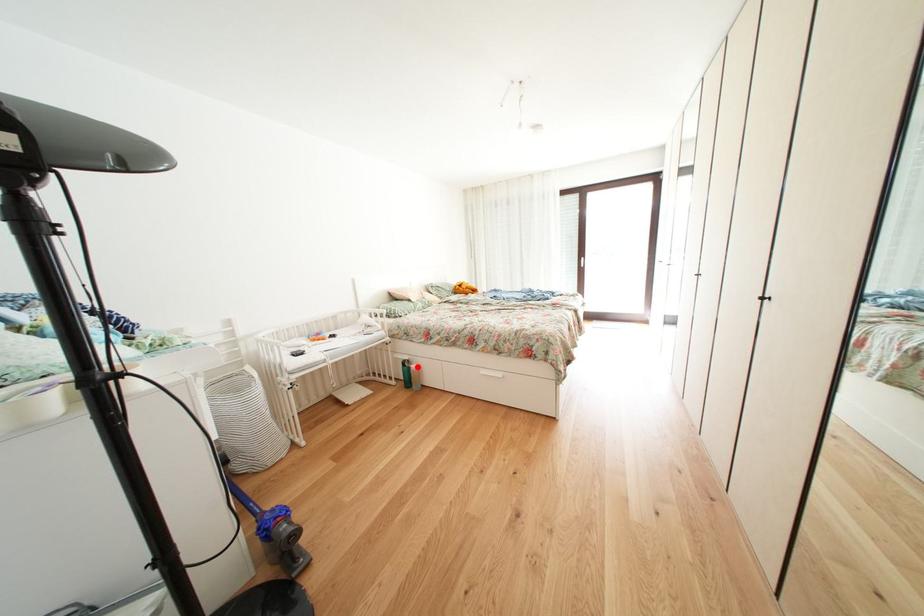
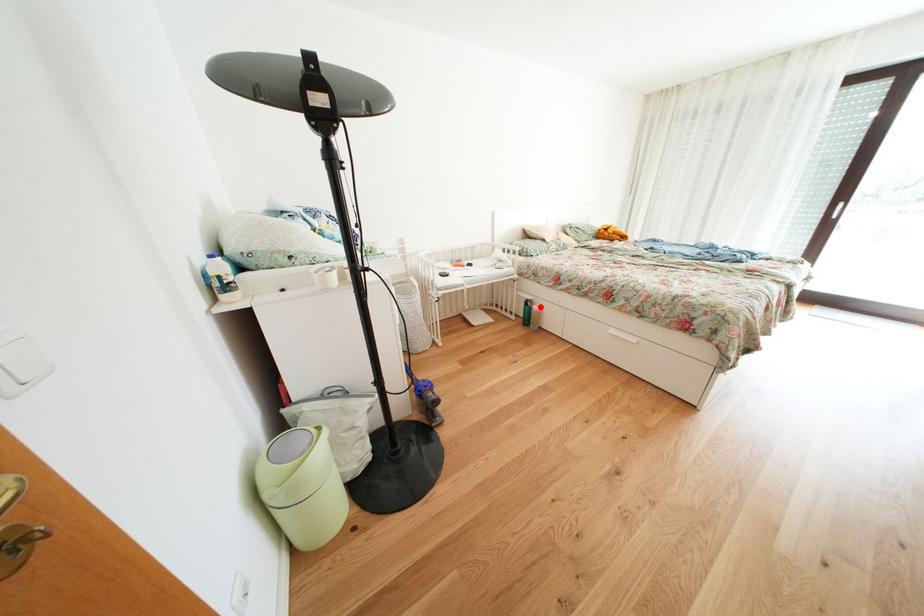
I am providing you with two images of the same scene from different viewpoints. A red point is marked on the first image and another point is marked on the second image. Does the point marked in image1 correspond to the same location as the one in image2?

Yes